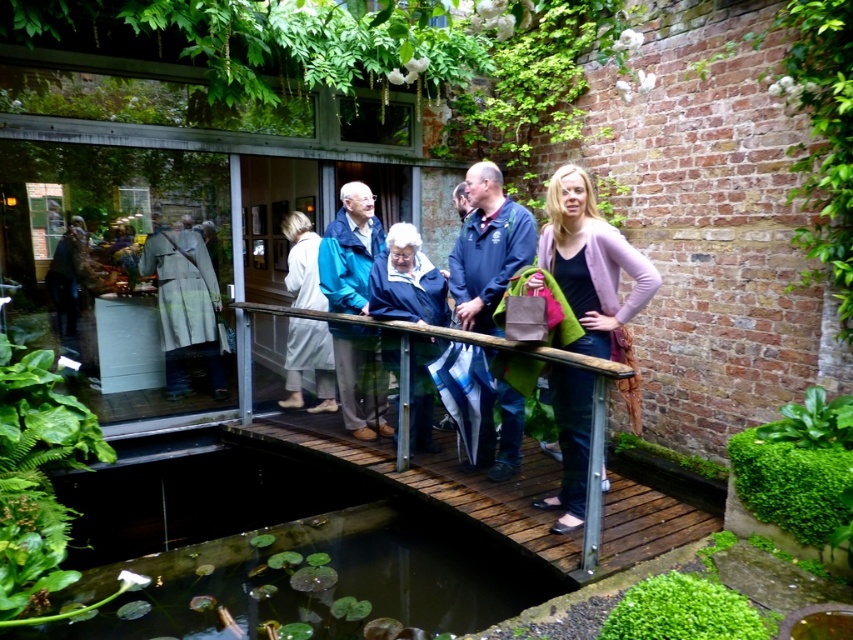
Question: Based on their relative distances, which object is nearer to the pink wool sweater at center?

Choices:
 (A) green leafy pond at lower left
 (B) white fabric coat at center

Answer: (A)

Question: Can you confirm if green leafy pond at lower left is positioned below blue fabric jacket at center?

Choices:
 (A) no
 (B) yes

Answer: (B)

Question: Is green leafy pond at lower left closer to the viewer compared to white fabric coat at center?

Choices:
 (A) yes
 (B) no

Answer: (A)

Question: Which point appears closest to the camera in this image?

Choices:
 (A) (335, 406)
 (B) (567, 440)
 (C) (469, 605)

Answer: (C)

Question: Is the position of pink wool sweater at center less distant than that of green mossy patch at lower right?

Choices:
 (A) no
 (B) yes

Answer: (A)

Question: Which object is closer to the camera taking this photo?

Choices:
 (A) pink wool sweater at center
 (B) green mossy patch at lower right
 (C) white fabric coat at center
 (D) green leafy pond at lower left

Answer: (B)